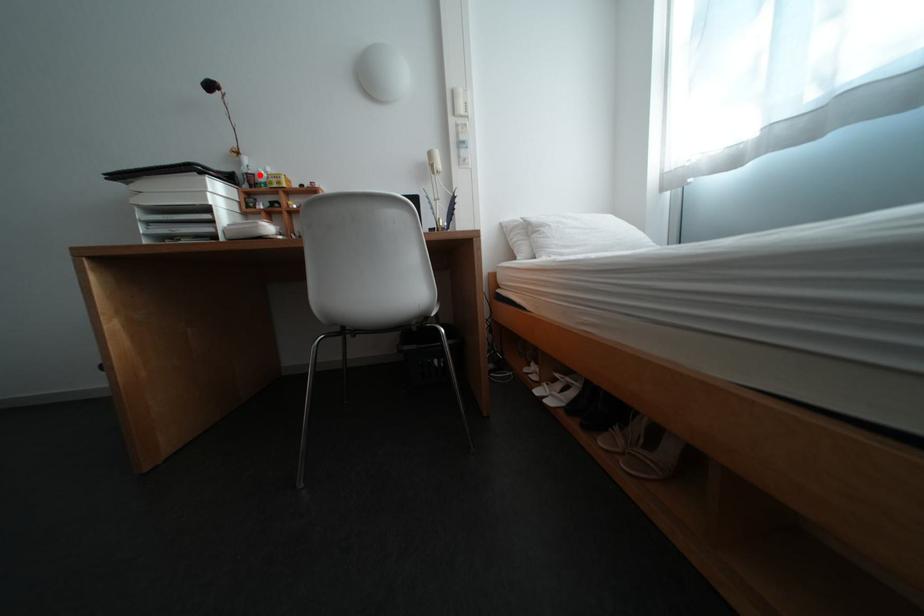
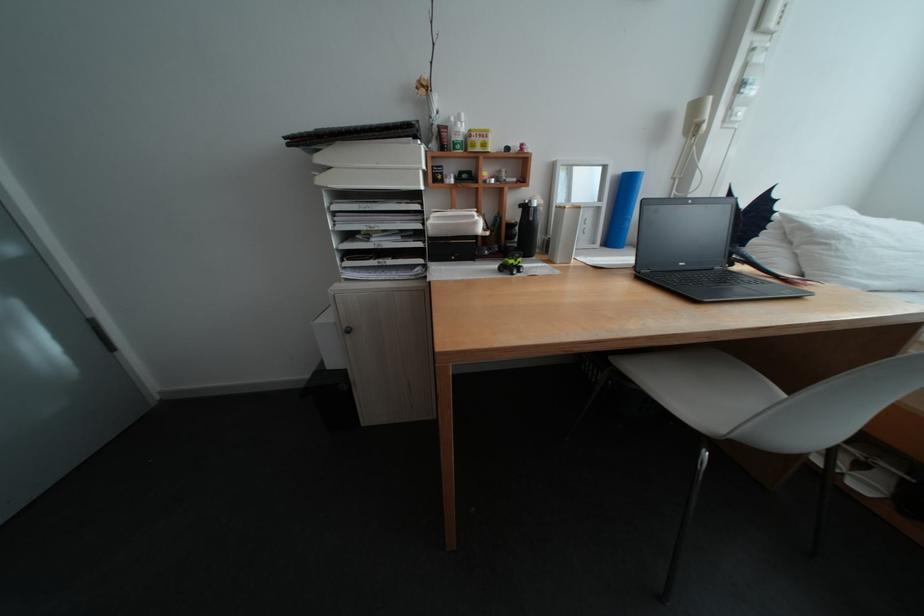
Locate, in the second image, the point that corresponds to the highlighted location in the first image.

(453, 128)